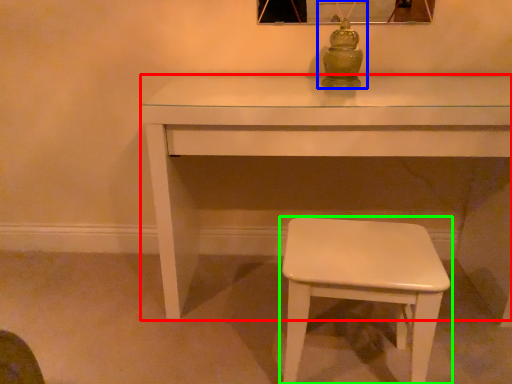
Question: Based on their relative distances, which object is nearer to table (highlighted by a red box)? Choose from table lamp (highlighted by a blue box) and stool (highlighted by a green box).

Choices:
 (A) table lamp
 (B) stool

Answer: (A)